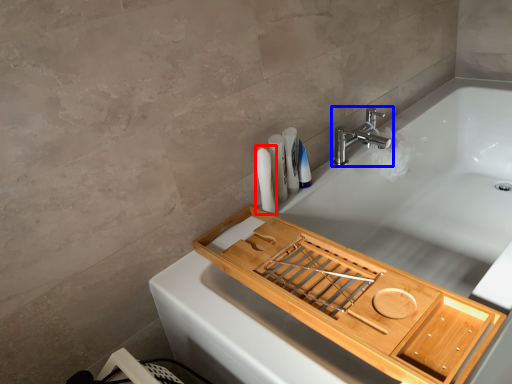
Question: Which object is further to the camera taking this photo, toiletry (highlighted by a red box) or tap (highlighted by a blue box)?

Choices:
 (A) toiletry
 (B) tap

Answer: (B)